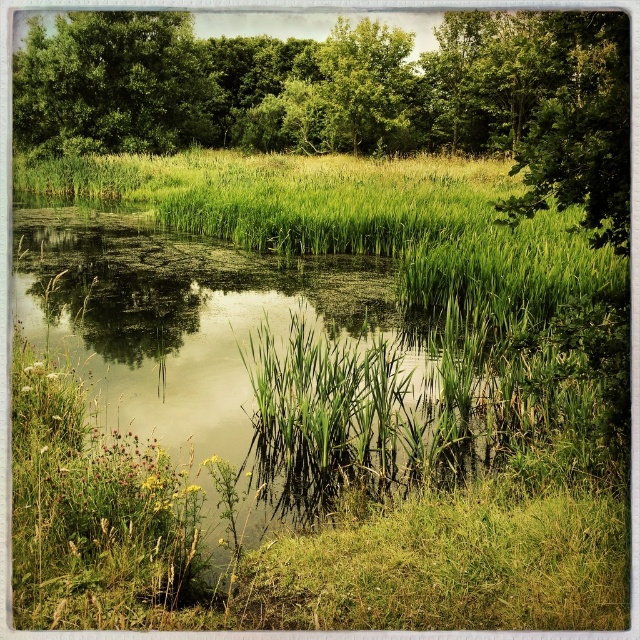
Question: Which of the following is the closest to the observer?

Choices:
 (A) (54, 129)
 (B) (563, 33)

Answer: (B)

Question: Is green leafy tree at center smaller than green leafy tree at upper left?

Choices:
 (A) no
 (B) yes

Answer: (A)

Question: In this image, where is green leafy tree at center located relative to green leafy tree at upper left?

Choices:
 (A) left
 (B) right

Answer: (B)

Question: Can you confirm if green leafy tree at center is wider than green leafy tree at upper left?

Choices:
 (A) yes
 (B) no

Answer: (A)

Question: Which point appears closest to the camera in this image?

Choices:
 (A) (332, 122)
 (B) (176, 81)

Answer: (B)